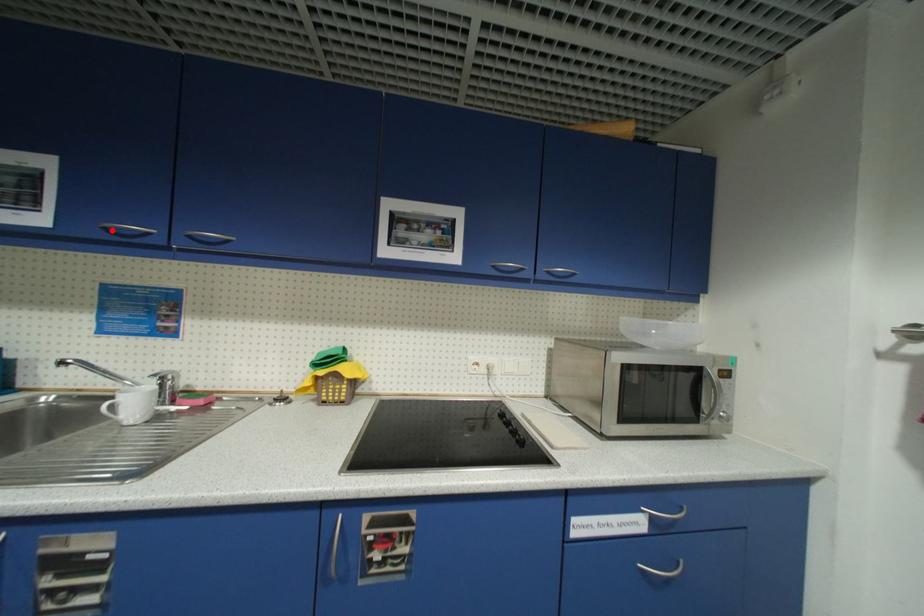
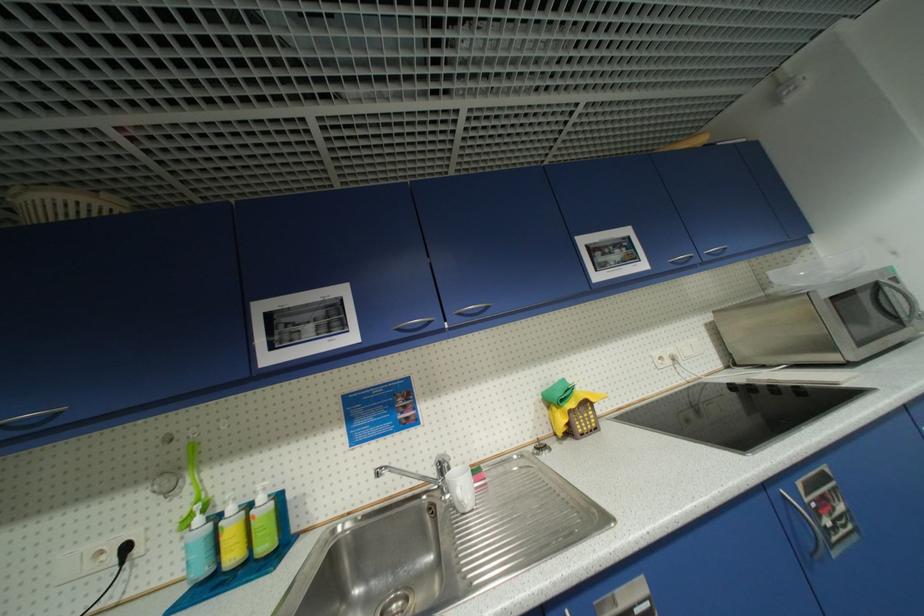
Question: I am providing you with two images of the same scene from different viewpoints. A red point is marked on the first image. Can you still see the location of the red point in image 2?

Choices:
 (A) Yes
 (B) No

Answer: (A)